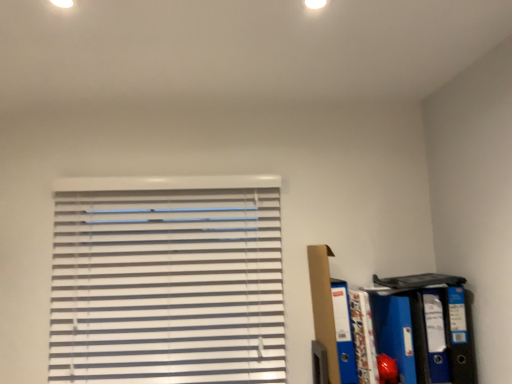
Describe the element at coordinates (362, 337) in the screenshot. I see `patterned paper book at right` at that location.

Locate an element on the screen. patterned paper book at right is located at coordinates (362, 337).

What are the coordinates of `patterned paper book at right` in the screenshot? It's located at (362, 337).